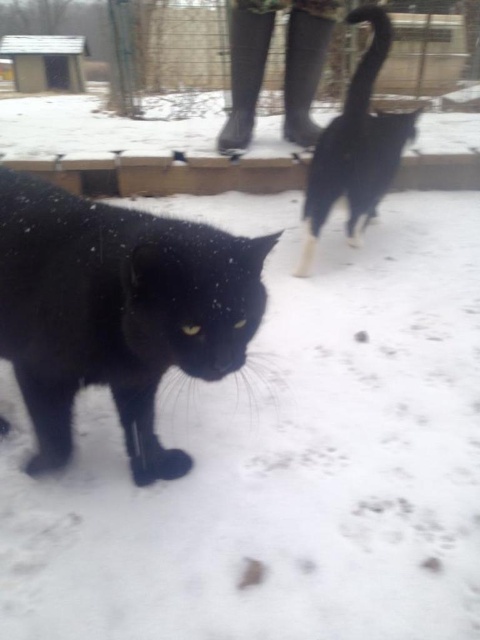
Question: Observing the image, what is the correct spatial positioning of black matte fur cat at center in reference to black fur cat at upper right?

Choices:
 (A) right
 (B) left

Answer: (B)

Question: In this image, where is black matte fur cat at center located relative to black fur cat at upper right?

Choices:
 (A) above
 (B) below

Answer: (B)

Question: Does black matte fur cat at center appear on the left side of black fur cat at upper right?

Choices:
 (A) yes
 (B) no

Answer: (A)

Question: Among these objects, which one is farthest from the camera?

Choices:
 (A) black matte fur cat at center
 (B) black fur cat at upper right

Answer: (B)